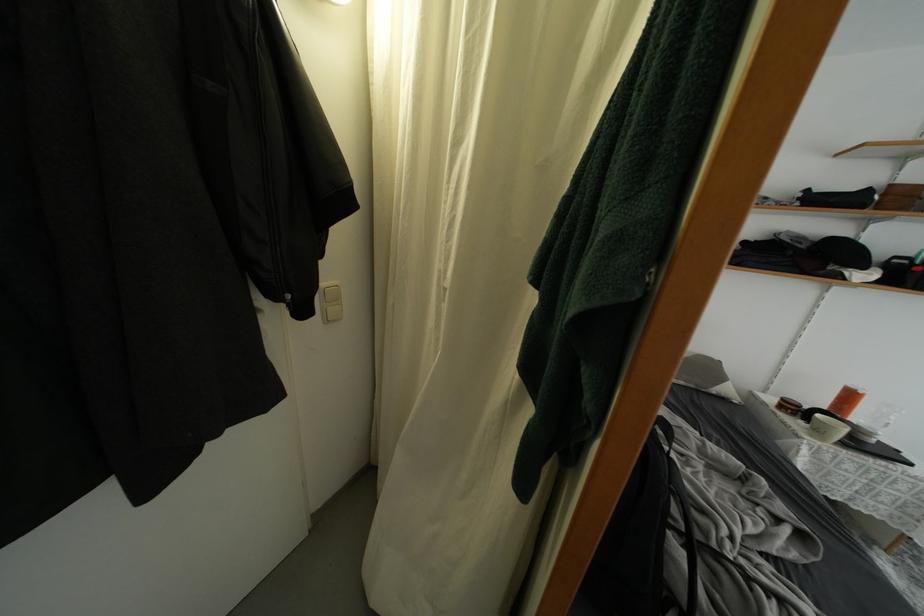
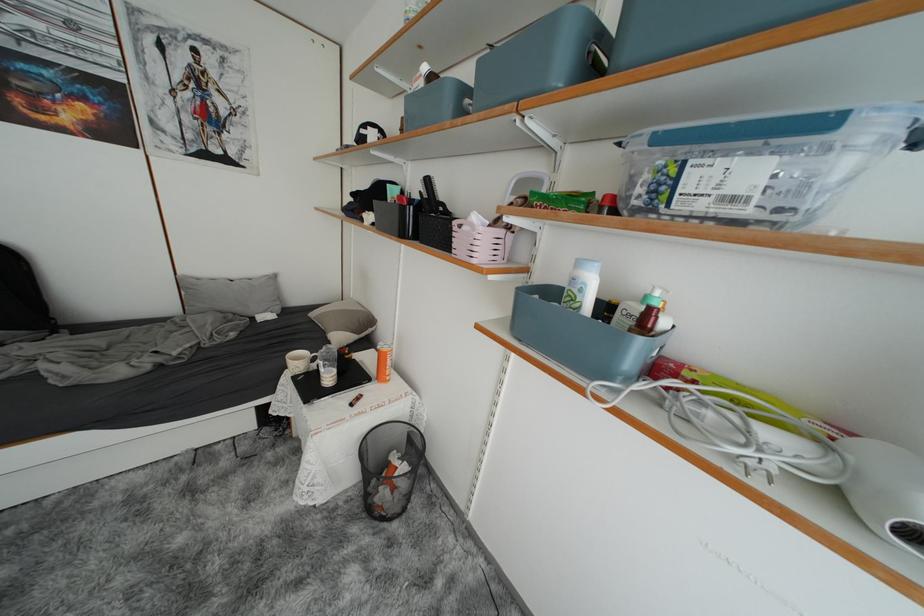
Question: In a continuous first-person perspective shot, in which direction is the camera moving?

Choices:
 (A) Left
 (B) Right
 (C) Forward
 (D) Backward

Answer: (B)